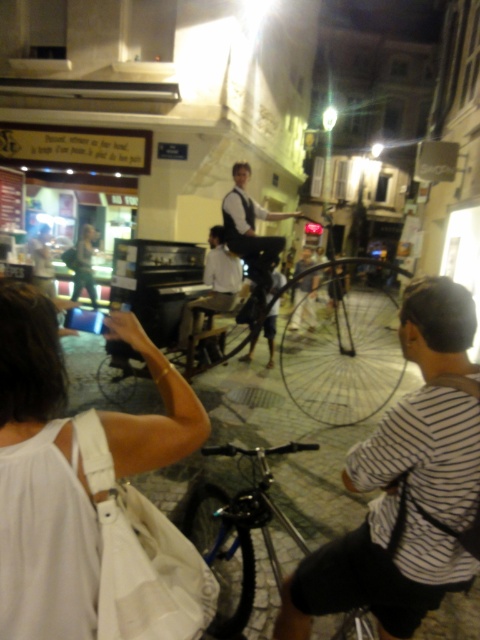
Can you confirm if white fabric bag at lower left is positioned above metallic silver bicycle at center?

No.

Based on the photo, measure the distance between point (4, 426) and camera.

They are 3.66 feet apart.

The image size is (480, 640). I want to click on white fabric bag at lower left, so click(x=90, y=493).

Which is more to the left, blue metallic bicycle at center or white shirt at center?

blue metallic bicycle at center

Can you confirm if blue metallic bicycle at center is positioned to the right of white shirt at center?

Incorrect, blue metallic bicycle at center is not on the right side of white shirt at center.

Image resolution: width=480 pixels, height=640 pixels. What do you see at coordinates (238, 532) in the screenshot?
I see `blue metallic bicycle at center` at bounding box center [238, 532].

At what (x,y) coordinates should I click in order to perform the action: click on blue metallic bicycle at center. Please return your answer as a coordinate pair (x, y). Looking at the image, I should click on (238, 532).

Does white fabric bag at lower left have a smaller size compared to matte black dress at center?

Correct, white fabric bag at lower left occupies less space than matte black dress at center.

Can you confirm if white fabric bag at lower left is wider than matte black dress at center?

In fact, white fabric bag at lower left might be narrower than matte black dress at center.

Locate an element on the screen. The height and width of the screenshot is (640, 480). white fabric bag at lower left is located at coordinates (90, 493).